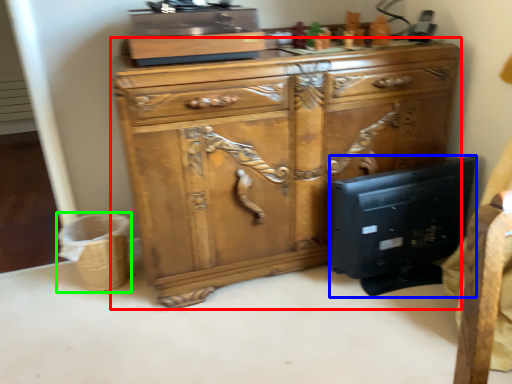
Question: Estimate the real-world distances between objects in this image. Which object is closer to chest of drawers (highlighted by a red box), desktop computer (highlighted by a blue box) or basket (highlighted by a green box)?

Choices:
 (A) desktop computer
 (B) basket

Answer: (A)